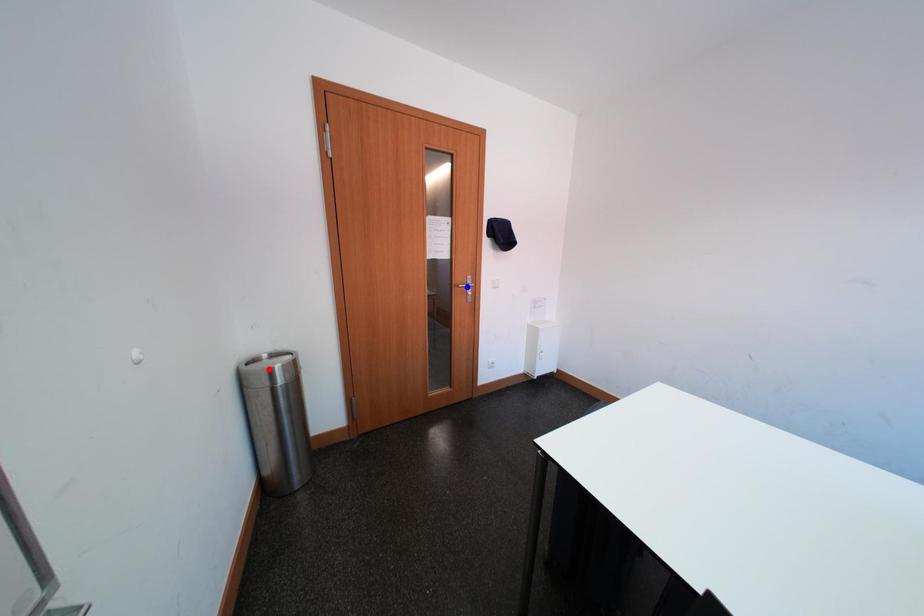
Question: Two points are marked on the image. Which point is closer to the camera?

Choices:
 (A) Blue point is closer.
 (B) Red point is closer.

Answer: (B)